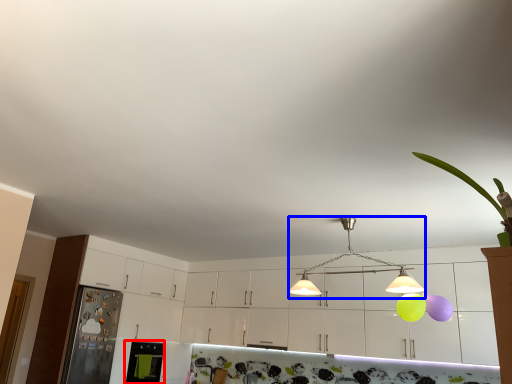
Question: Among these objects, which one is farthest to the camera, appliance (highlighted by a red box) or light (highlighted by a blue box)?

Choices:
 (A) appliance
 (B) light

Answer: (A)